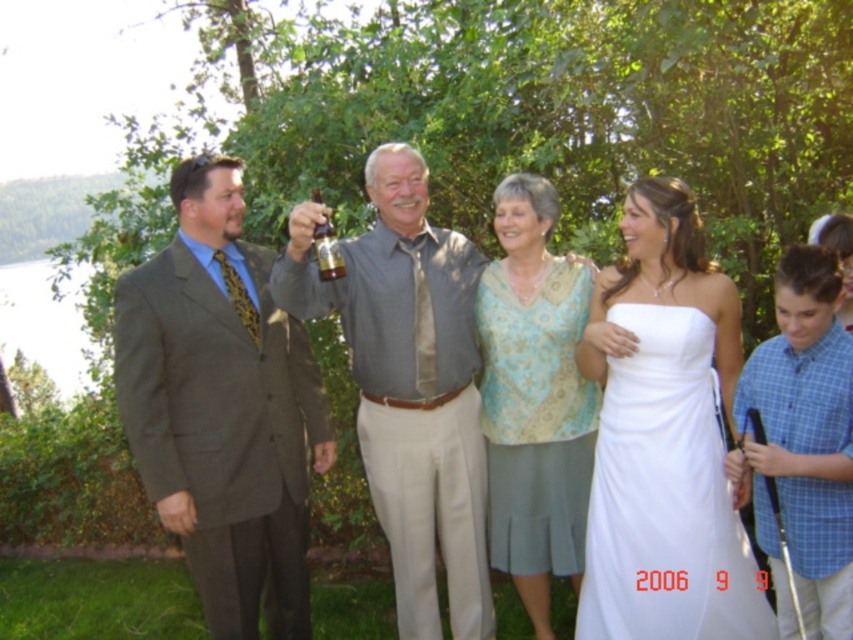
Looking at this image, is matte brown suit at left in front of white satin dress at right?

That is False.

Is matte brown suit at left wider than white satin dress at right?

Yes, matte brown suit at left is wider than white satin dress at right.

Between point (154, 314) and point (705, 582), which one is positioned behind?

The point (154, 314) is behind.

Identify the location of matte brown suit at left. (222, 406).

Is matte gray suit at left to the left of gray shirt at center from the viewer's perspective?

Yes, matte gray suit at left is to the left of gray shirt at center.

Is matte gray suit at left bigger than gray shirt at center?

Yes, matte gray suit at left is bigger than gray shirt at center.

Who is more forward, (375, 264) or (436, 509)?

Point (375, 264)

Find the location of a particular element. The width and height of the screenshot is (853, 640). matte gray suit at left is located at coordinates (363, 323).

Is gray shirt at center wider than white satin dress at right?

Correct, the width of gray shirt at center exceeds that of white satin dress at right.

Identify the location of gray shirt at center. This screenshot has width=853, height=640. (409, 385).